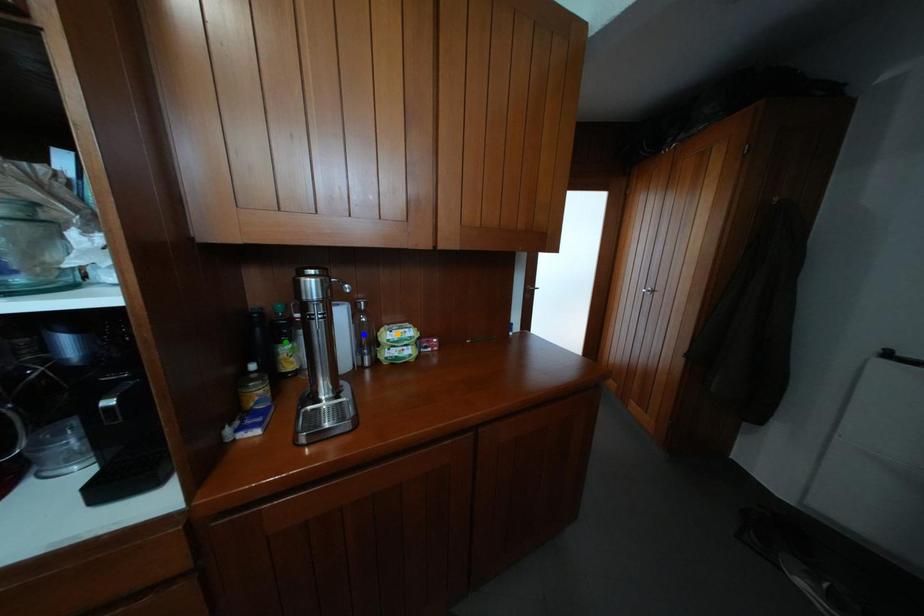
Order these from nearest to farthest:
blue point
green point
orange point

1. green point
2. blue point
3. orange point